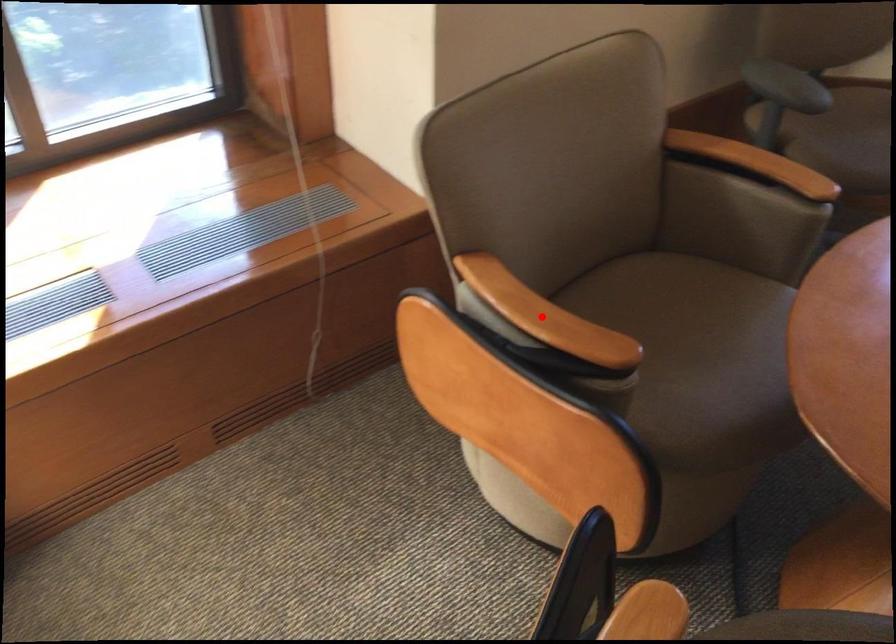
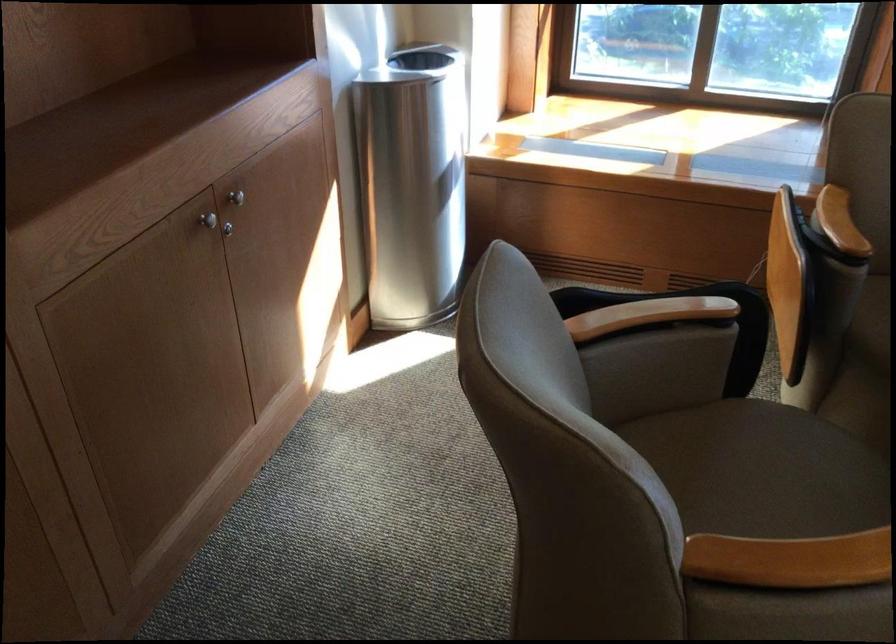
Question: I am providing you with two images of the same scene from different viewpoints. A red point is marked on the first image. At the location where the point appears in image 1, is it still visible in image 2?

Choices:
 (A) Yes
 (B) No

Answer: (A)